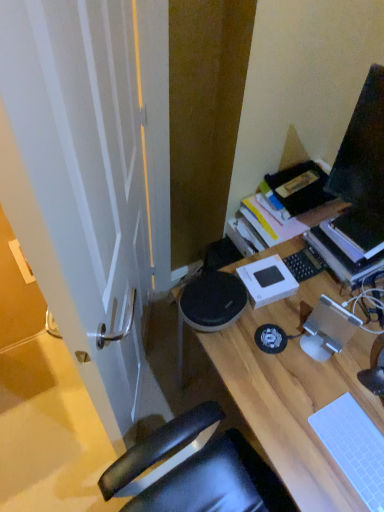
Locate an element on the screen. The width and height of the screenshot is (384, 512). vacant space behind white matte laptop keyboard at lower right, the first laptop keyboard ordered from the bottom is located at coordinates (x=338, y=381).